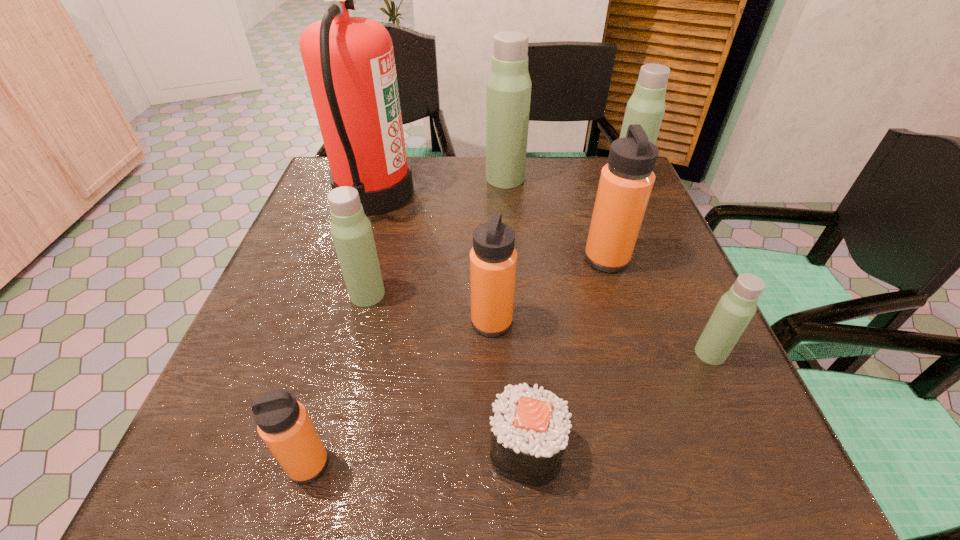
At what (x,y) coordinates should I click in order to perform the action: click on the tallest object. Please return your answer as a coordinate pair (x, y). The image size is (960, 540). Looking at the image, I should click on (349, 62).

This screenshot has width=960, height=540. What are the coordinates of `fire extinguisher` in the screenshot? It's located at (349, 62).

The width and height of the screenshot is (960, 540). Identify the location of the eighth shortest object. (509, 85).

What are the coordinates of `the biggest light thermos bottle` in the screenshot? It's located at (509, 85).

At what (x,y) coordinates should I click in order to perform the action: click on the second biggest light thermos bottle. Please return your answer as a coordinate pair (x, y). Looking at the image, I should click on (646, 107).

This screenshot has width=960, height=540. Identify the location of the farthest orange thermos bottle. (626, 181).

Find the location of a particular element. The image size is (960, 540). the biggest orange thermos bottle is located at coordinates (626, 181).

Identify the location of the second orange thermos bottle from right to left. The width and height of the screenshot is (960, 540). (493, 259).

Locate an element on the screen. This screenshot has width=960, height=540. the second nearest orange thermos bottle is located at coordinates (493, 259).

This screenshot has height=540, width=960. Identify the location of the leftmost light thermos bottle. (351, 230).